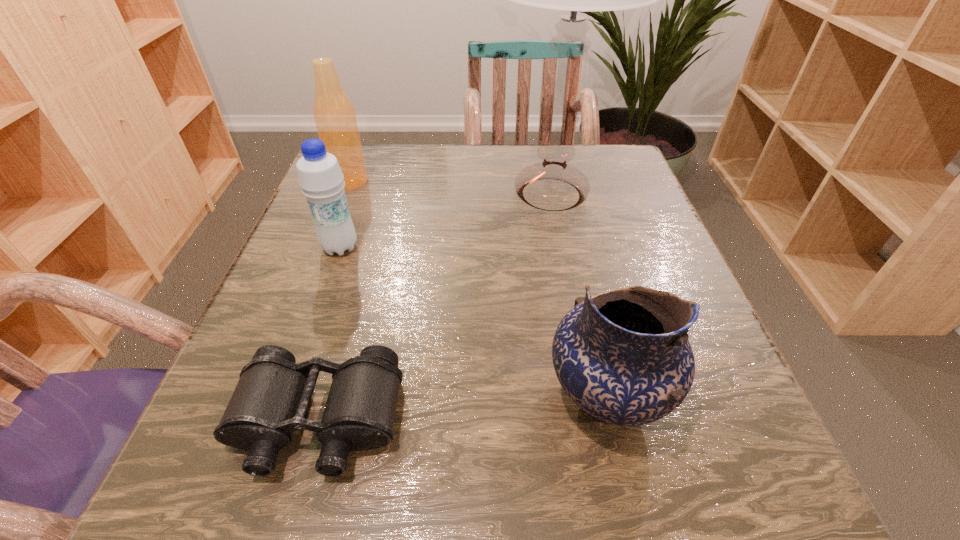
Identify the location of free spot between the water bottle and the shortest object. (329, 334).

Where is `free space between the shortest object and the fourth shortest object`? This screenshot has width=960, height=540. free space between the shortest object and the fourth shortest object is located at coordinates (334, 301).

You are a GUI agent. You are given a task and a screenshot of the screen. Output one action in this format:
    pyautogui.click(x=<x>, y=<y>)
    Task: Click on the free point between the fourth shortest object and the pottery
    This screenshot has width=960, height=540.
    Given the screenshot: What is the action you would take?
    pyautogui.click(x=478, y=289)

Where is `free space between the pottery and the third farthest object`? free space between the pottery and the third farthest object is located at coordinates (473, 322).

Find the location of a particular element. free space between the pottery and the table lamp is located at coordinates (578, 295).

Where is `empty space that is in between the table lamp and the beer bottle`? Image resolution: width=960 pixels, height=540 pixels. empty space that is in between the table lamp and the beer bottle is located at coordinates (450, 188).

Locate an element on the screen. The image size is (960, 540). free space between the pottery and the tallest object is located at coordinates (578, 295).

Locate an element on the screen. vacant area between the pottery and the tallest object is located at coordinates (578, 295).

Find the location of a particular element. free space between the pottery and the table lamp is located at coordinates (578, 295).

Select which object is the closest to the water bottle. Please provide its 2D coordinates. Your answer should be formatted as a tuple, i.e. [(x, y)], where the tuple contains the x and y coordinates of a point satisfying the conditions above.

[(334, 115)]